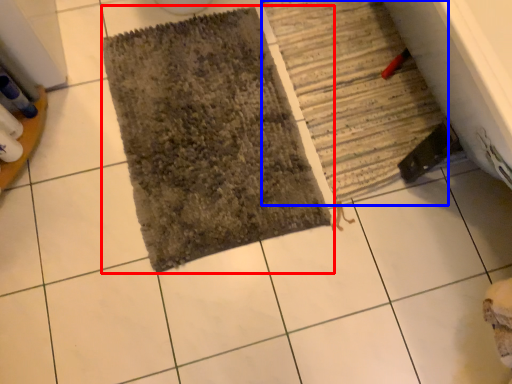
Question: Which point is further to the camera, bath mat (highlighted by a red box) or bath mat (highlighted by a blue box)?

Choices:
 (A) bath mat
 (B) bath mat

Answer: (B)